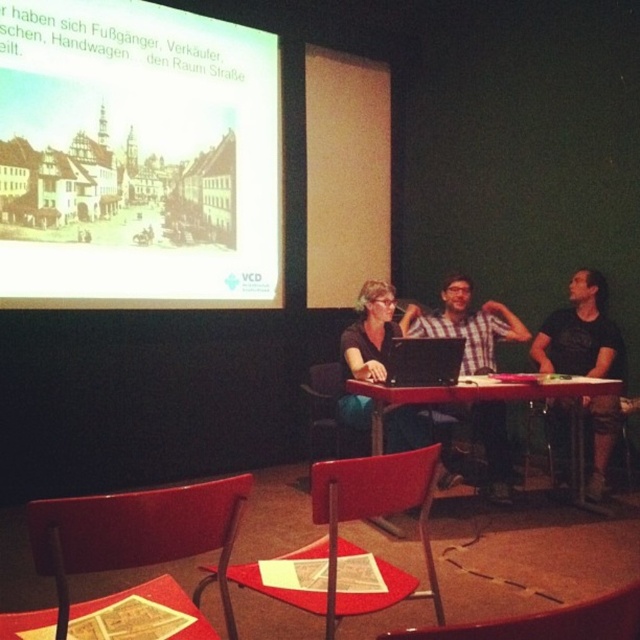
Is matte red chair at lower center further to the viewer compared to metallic red chair at lower center?

Yes, matte red chair at lower center is behind metallic red chair at lower center.

Who is positioned more to the left, matte red chair at lower center or metallic red chair at lower center?

matte red chair at lower center is more to the left.

Does point (362, 486) lie in front of point (602, 627)?

No, it is not.

This screenshot has height=640, width=640. I want to click on matte red chair at lower center, so click(x=362, y=518).

Does yellowish paper slide at upper left appear over black matte laptop at center?

Correct, yellowish paper slide at upper left is located above black matte laptop at center.

This screenshot has width=640, height=640. I want to click on yellowish paper slide at upper left, so [x=136, y=156].

Measure the distance between yellowish paper slide at upper left and camera.

They are 3.72 meters apart.

At what (x,y) coordinates should I click in order to perform the action: click on yellowish paper slide at upper left. Please return your answer as a coordinate pair (x, y). This screenshot has width=640, height=640. Looking at the image, I should click on (136, 156).

Which is behind, point (490, 634) or point (444, 340)?

Positioned behind is point (444, 340).

Which is more to the left, metallic red chair at lower center or black matte laptop at center?

→ metallic red chair at lower center is more to the left.

Does point (634, 608) come behind point (422, 358)?

No, it is not.

Where is `metallic red chair at lower center`? This screenshot has width=640, height=640. metallic red chair at lower center is located at coordinates (548, 621).